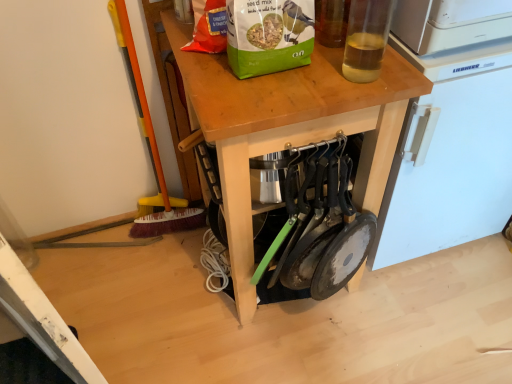
Locate an element on the screen. The width and height of the screenshot is (512, 384). free point in front of wooden at center is located at coordinates (290, 349).